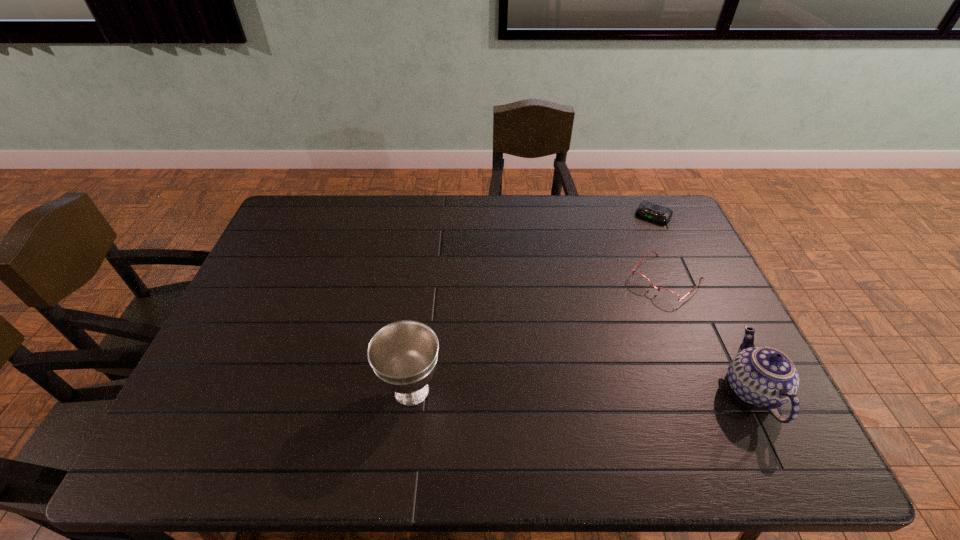
I want to click on vacant spot on the desktop that is between the leftmost object and the second tallest object and is positioned on the display of the alarm clock, so click(548, 390).

The width and height of the screenshot is (960, 540). What are the coordinates of `vacant space on the desktop that is between the chalice and the chinaware and is positioned on the lenses of the spectacles` in the screenshot? It's located at (552, 390).